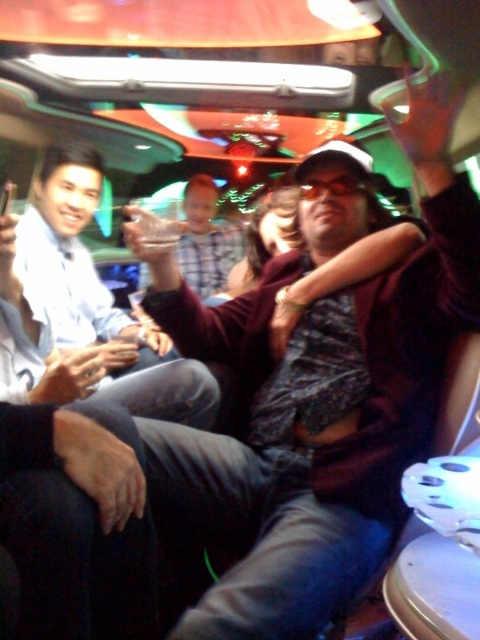
Does point (123, 353) come behind point (201, 209)?

No, (123, 353) is in front of (201, 209).

This screenshot has height=640, width=480. I want to click on matte white shirt at left, so click(x=93, y=298).

Where is `matte white shirt at left`? This screenshot has height=640, width=480. matte white shirt at left is located at coordinates click(x=93, y=298).